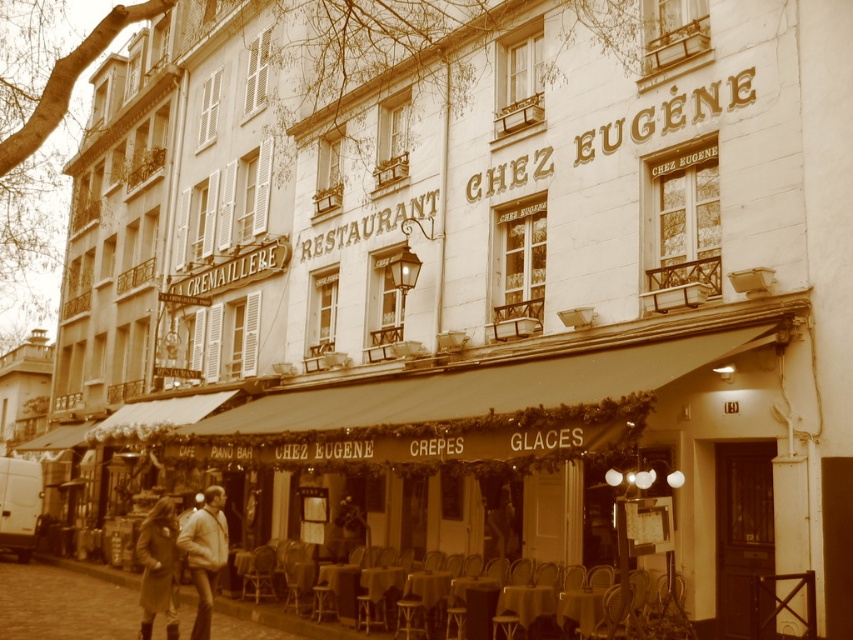
Question: Among these points, which one is nearest to the camera?

Choices:
 (A) (215, 566)
 (B) (172, 548)
 (C) (636, 604)

Answer: (C)

Question: Does metallic silver chair at lower center appear on the left side of brown leather coat at lower left?

Choices:
 (A) yes
 (B) no

Answer: (B)

Question: Which of the following is the closest to the observer?

Choices:
 (A) (251, 552)
 (B) (152, 605)
 (C) (193, 547)

Answer: (B)

Question: Does metallic silver chair at lower center appear on the left side of light brown leather jacket at lower left?

Choices:
 (A) yes
 (B) no

Answer: (B)

Question: Which point appears farthest from the camera in this image?

Choices:
 (A) (260, 577)
 (B) (148, 522)

Answer: (A)

Question: Is metallic silver chair at lower center smaller than brown leather coat at lower left?

Choices:
 (A) yes
 (B) no

Answer: (A)